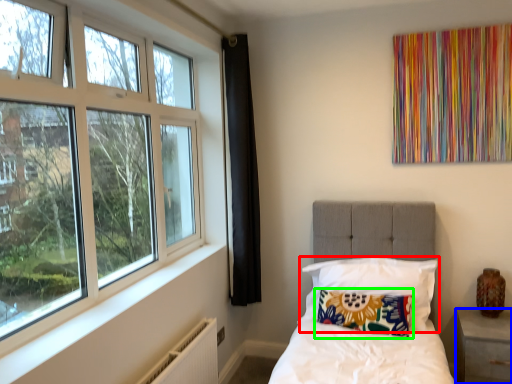
Question: Estimate the real-world distances between objects in this image. Which object is closer to pillow (highlighted by a red box), nightstand (highlighted by a blue box) or pillow (highlighted by a green box)?

Choices:
 (A) nightstand
 (B) pillow

Answer: (B)